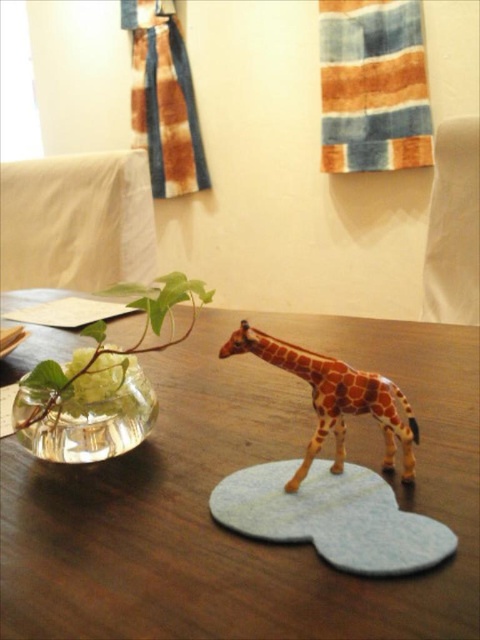
Question: Among these objects, which one is nearest to the camera?

Choices:
 (A) clear glass vase at left
 (B) brown wooden table at center

Answer: (B)

Question: Considering the relative positions of brown wooden table at center and light blue felt mat at center in the image provided, where is brown wooden table at center located with respect to light blue felt mat at center?

Choices:
 (A) below
 (B) above

Answer: (B)

Question: Based on their relative distances, which object is nearer to the brown wooden table at center?

Choices:
 (A) clear glass vase at left
 (B) light blue felt mat at center
 (C) orange spotted plastic giraffe at center
 (D) transparent glass vase at left

Answer: (A)

Question: Does brown wooden table at center have a lesser width compared to clear glass vase at left?

Choices:
 (A) yes
 (B) no

Answer: (B)

Question: Among these points, which one is farthest from the camera?

Choices:
 (A) (178, 426)
 (B) (333, 378)
 (C) (22, 384)

Answer: (A)

Question: Does transparent glass vase at left have a larger size compared to orange spotted plastic giraffe at center?

Choices:
 (A) no
 (B) yes

Answer: (A)